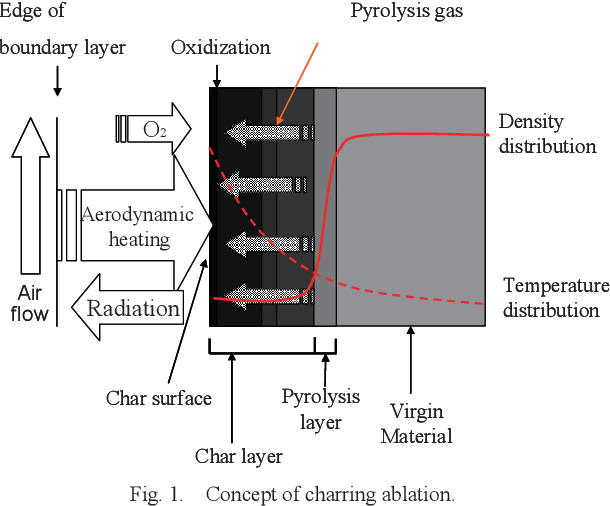
Where is `small bracket`? The width and height of the screenshot is (610, 506). small bracket is located at coordinates point(314,348), point(334,347).